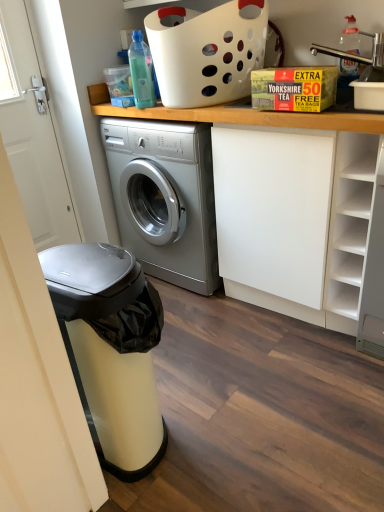
I want to click on empty space that is ontop of metallic stainless steel dishwasher at left (from a real-world perspective), so click(84, 264).